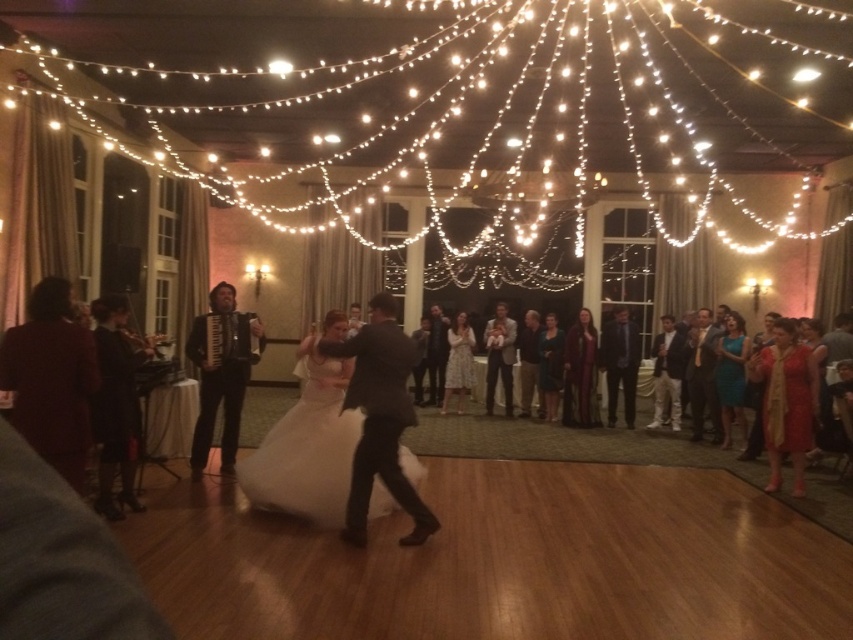
You are a photographer at the wedding reception. You need to capture a photo of both the white satin dress at center and the white floral dress at center. Which dress should you focus on first to ensure it fits in the frame?

The white satin dress at center has a larger size compared to white floral dress at center, so you should focus on the white satin dress at center first to ensure it fits in the frame.

You are a photographer at the wedding reception. You want to capture a photo of both the white satin dress at center and the white floral dress at center. Since the camera frame can only fit one of them, which dress should you choose to ensure the entire dress fits in the frame?

The white satin dress at center is wider than the white floral dress at center, so you should choose the white floral dress at center to ensure the entire dress fits in the frame.